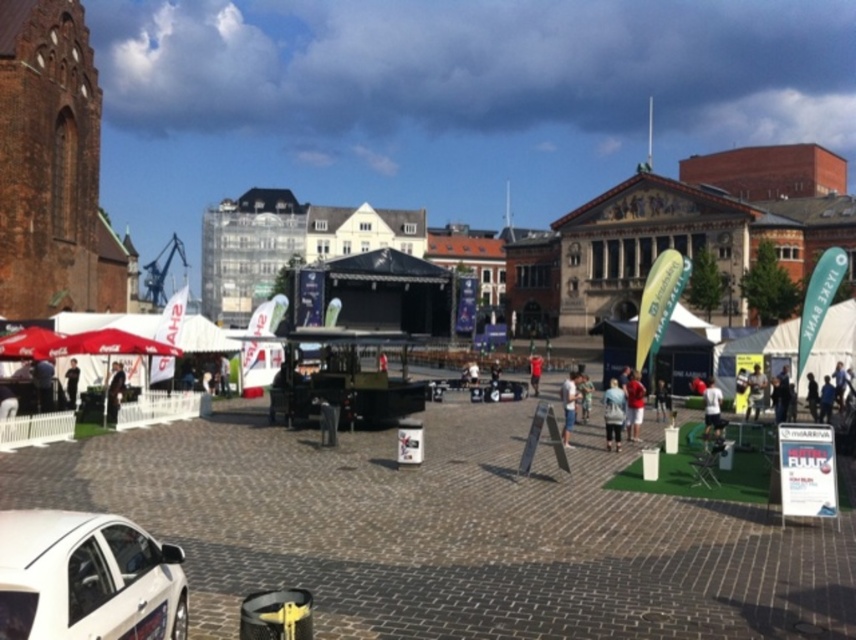
Question: Is light blue jeans at center below red fabric person at center?

Choices:
 (A) yes
 (B) no

Answer: (A)

Question: Which of the following is the farthest from the observer?

Choices:
 (A) light blue denim jacket at center
 (B) red fabric person at center
 (C) white matte shirt at center

Answer: (B)

Question: Is light blue jeans at center further to the viewer compared to dark blue jacket at center?

Choices:
 (A) no
 (B) yes

Answer: (A)

Question: Among these objects, which one is nearest to the camera?

Choices:
 (A) dark blue jeans at left
 (B) matte black jacket at left
 (C) brown leather jacket at center

Answer: (A)

Question: Which of the following is the closest to the observer?

Choices:
 (A) (538, 355)
 (B) (39, 401)
 (C) (710, 429)

Answer: (C)

Question: Does white matte car at lower left appear under dark blue jacket at center?

Choices:
 (A) yes
 (B) no

Answer: (A)